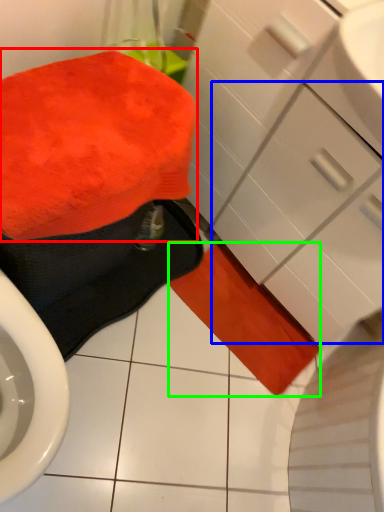
Question: Based on their relative distances, which object is farther from bath towel (highlighted by a red box)? Choose from drawer (highlighted by a blue box) and bath towel (highlighted by a green box).

Choices:
 (A) drawer
 (B) bath towel

Answer: (B)